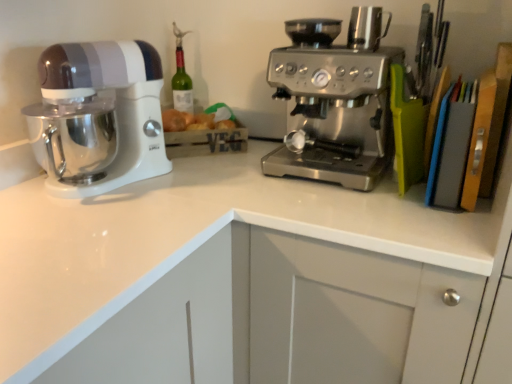
Where is `satin silver coffee maker at center`? The height and width of the screenshot is (384, 512). satin silver coffee maker at center is located at coordinates (335, 100).

Find the location of `white glossy mixer at left`. white glossy mixer at left is located at coordinates (102, 114).

The width and height of the screenshot is (512, 384). What do you see at coordinates (102, 114) in the screenshot?
I see `white glossy mixer at left` at bounding box center [102, 114].

What do you see at coordinates (244, 279) in the screenshot?
I see `white glossy countertop at center` at bounding box center [244, 279].

I want to click on satin silver coffee maker at center, so click(335, 100).

Which is closer to the camera, [55,96] or [140,218]?

Point [55,96].

Could you tell me if white glossy mixer at left is facing white glossy countertop at center?

No, white glossy mixer at left is not turned towards white glossy countertop at center.

Considering the relative sizes of white glossy mixer at left and white glossy countertop at center in the image provided, is white glossy mixer at left bigger than white glossy countertop at center?

No.

Is white glossy mixer at left in front of or behind white glossy countertop at center in the image?

Visually, white glossy mixer at left is located behind white glossy countertop at center.

Which is more distant, (89, 280) or (340, 175)?

The point (340, 175) is more distant.

From the image's perspective, is white glossy countertop at center above or below satin silver coffee maker at center?

white glossy countertop at center is below satin silver coffee maker at center.

Between white glossy countertop at center and satin silver coffee maker at center, which one has larger size?

white glossy countertop at center is bigger.

Image resolution: width=512 pixels, height=384 pixels. I want to click on coffee maker behind the white glossy countertop at center, so click(x=335, y=100).

Is satin silver coffee maker at center situated inside white glossy countertop at center or outside?

satin silver coffee maker at center is inside white glossy countertop at center.

From a real-world perspective, is satin silver coffee maker at center positioned over white glossy countertop at center based on gravity?

Yes, from a real-world perspective, satin silver coffee maker at center is above white glossy countertop at center.

Is satin silver coffee maker at center far away from white glossy countertop at center?

No, satin silver coffee maker at center is in close proximity to white glossy countertop at center.

What's the angular difference between stainless steel coffee maker at upper right and white glossy mixer at left's facing directions?

68.5 degrees.

How much distance is there between stainless steel coffee maker at upper right and white glossy mixer at left?

25.29 inches.

Can you confirm if stainless steel coffee maker at upper right is shorter than white glossy mixer at left?

Correct, stainless steel coffee maker at upper right is not as tall as white glossy mixer at left.

Between stainless steel coffee maker at upper right and white glossy mixer at left, which one has smaller width?

With smaller width is stainless steel coffee maker at upper right.

Is white glossy countertop at center at the back of stainless steel coffee maker at upper right?

No, stainless steel coffee maker at upper right is not facing away from white glossy countertop at center.

From the image's perspective, which one is positioned higher, stainless steel coffee maker at upper right or white glossy countertop at center?

stainless steel coffee maker at upper right is shown above in the image.

Considering the relative positions of stainless steel coffee maker at upper right and white glossy countertop at center in the image provided, is stainless steel coffee maker at upper right behind white glossy countertop at center?

Yes, stainless steel coffee maker at upper right is behind white glossy countertop at center.

Is point (351, 12) closer to viewer compared to point (382, 325)?

That is False.

How much distance is there between white glossy countertop at center and white glossy mixer at left?

white glossy countertop at center and white glossy mixer at left are 12.67 inches apart.

Which of these two, white glossy countertop at center or white glossy mixer at left, stands taller?

white glossy countertop at center is taller.

Is point (71, 380) less distant than point (136, 105)?

Yes, point (71, 380) is in front of point (136, 105).

From the image's perspective, is white glossy countertop at center on white glossy mixer at left?

No, from the image's perspective, white glossy countertop at center is not over white glossy mixer at left.

Considering the relative sizes of stainless steel coffee maker at upper right and satin silver coffee maker at center in the image provided, is stainless steel coffee maker at upper right thinner than satin silver coffee maker at center?

Indeed, stainless steel coffee maker at upper right has a lesser width compared to satin silver coffee maker at center.

From a real-world perspective, is stainless steel coffee maker at upper right below satin silver coffee maker at center?

Incorrect, from a real-world perspective, stainless steel coffee maker at upper right is higher than satin silver coffee maker at center.

Considering the positions of point (365, 16) and point (370, 56), is point (365, 16) closer or farther from the camera than point (370, 56)?

Point (365, 16) appears to be farther away from the viewer than point (370, 56).

The width and height of the screenshot is (512, 384). Identify the location of mixer on the left of the white glossy countertop at center. (102, 114).

Where is `coffee maker located above the white glossy countertop at center (from a real-world perspective)`? The image size is (512, 384). coffee maker located above the white glossy countertop at center (from a real-world perspective) is located at coordinates (335, 100).

When comparing their distances from stainless steel coffee maker at upper right, does white glossy countertop at center or satin silver coffee maker at center seem closer?

satin silver coffee maker at center lies closer to stainless steel coffee maker at upper right than the other object.

Looking at the image, which one is located further to white glossy mixer at left, white glossy countertop at center or stainless steel coffee maker at upper right?

The object further to white glossy mixer at left is stainless steel coffee maker at upper right.

Estimate the real-world distances between objects in this image. Which object is further from white glossy mixer at left, stainless steel coffee maker at upper right or satin silver coffee maker at center?

stainless steel coffee maker at upper right.

From the picture: When comparing their distances from white glossy mixer at left, does satin silver coffee maker at center or white glossy countertop at center seem closer?

Based on the image, white glossy countertop at center appears to be nearer to white glossy mixer at left.

When comparing their distances from white glossy countertop at center, does stainless steel coffee maker at upper right or satin silver coffee maker at center seem further?

Based on the image, stainless steel coffee maker at upper right appears to be further to white glossy countertop at center.

Based on their spatial positions, is satin silver coffee maker at center or white glossy mixer at left closer to stainless steel coffee maker at upper right?

satin silver coffee maker at center lies closer to stainless steel coffee maker at upper right than the other object.

From the image, which object appears to be nearer to satin silver coffee maker at center, white glossy mixer at left or white glossy countertop at center?

white glossy countertop at center.

Which object lies nearer to the anchor point stainless steel coffee maker at upper right, white glossy mixer at left or white glossy countertop at center?

white glossy countertop at center is closer to stainless steel coffee maker at upper right.

At what (x,y) coordinates should I click in order to perform the action: click on coffee maker that lies between stainless steel coffee maker at upper right and white glossy countertop at center from top to bottom. Please return your answer as a coordinate pair (x, y). The image size is (512, 384). Looking at the image, I should click on (335, 100).

This screenshot has width=512, height=384. I want to click on mixer between stainless steel coffee maker at upper right and white glossy countertop at center in the up-down direction, so click(x=102, y=114).

What are the coordinates of `counter top between white glossy mixer at left and satin silver coffee maker at center` in the screenshot? It's located at (244, 279).

The height and width of the screenshot is (384, 512). I want to click on coffee maker between white glossy mixer at left and stainless steel coffee maker at upper right, so click(335, 100).